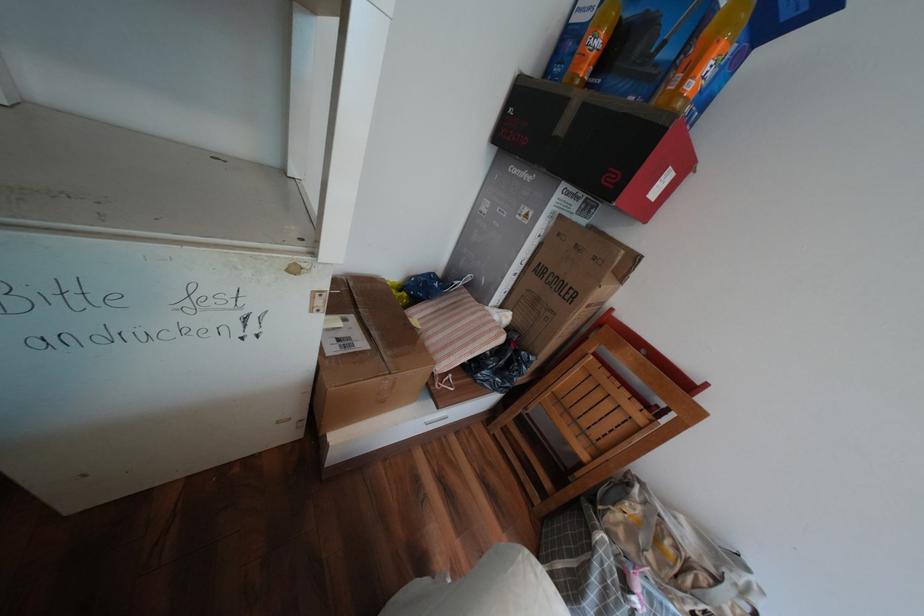
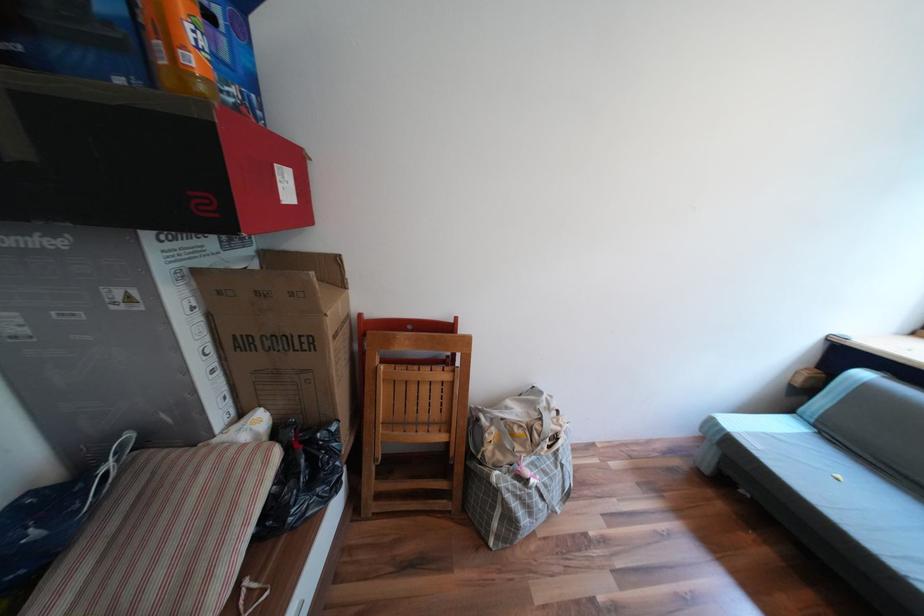
Find the pixel in the second image that matches (x=637, y=504) in the first image.

(495, 435)